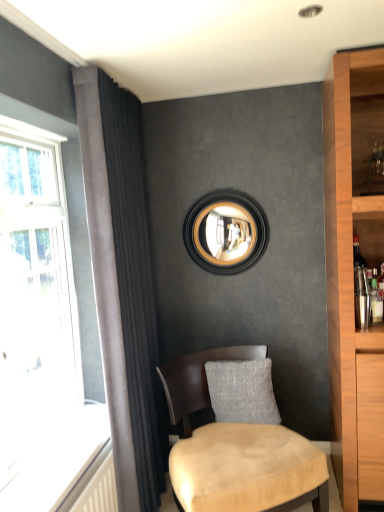
Question: From a real-world perspective, is suede beige chair at lower center over gray textured pillow at center?

Choices:
 (A) yes
 (B) no

Answer: (B)

Question: Is suede beige chair at lower center looking in the opposite direction of gray textured pillow at center?

Choices:
 (A) no
 (B) yes

Answer: (B)

Question: From a real-world perspective, is suede beige chair at lower center below gray textured pillow at center?

Choices:
 (A) no
 (B) yes

Answer: (B)

Question: Is suede beige chair at lower center to the right of gray textured pillow at center from the viewer's perspective?

Choices:
 (A) no
 (B) yes

Answer: (A)

Question: Does suede beige chair at lower center have a greater width compared to gray textured pillow at center?

Choices:
 (A) no
 (B) yes

Answer: (B)

Question: Would you say suede beige chair at lower center is outside gray textured pillow at center?

Choices:
 (A) yes
 (B) no

Answer: (A)

Question: From the image's perspective, does black wood picture frame at upper center appear lower than gray textured pillow at center?

Choices:
 (A) yes
 (B) no

Answer: (B)

Question: Considering the relative sizes of black wood picture frame at upper center and gray textured pillow at center in the image provided, is black wood picture frame at upper center wider than gray textured pillow at center?

Choices:
 (A) yes
 (B) no

Answer: (B)

Question: Can you confirm if black wood picture frame at upper center is positioned to the right of gray textured pillow at center?

Choices:
 (A) yes
 (B) no

Answer: (B)

Question: Does black wood picture frame at upper center lie in front of gray textured pillow at center?

Choices:
 (A) yes
 (B) no

Answer: (B)

Question: Would you say black wood picture frame at upper center is a long distance from gray textured pillow at center?

Choices:
 (A) yes
 (B) no

Answer: (B)

Question: Is black wood picture frame at upper center taller than gray textured pillow at center?

Choices:
 (A) yes
 (B) no

Answer: (A)

Question: Does gray textured pillow at center come behind dark grey velvet curtain at left?

Choices:
 (A) yes
 (B) no

Answer: (A)